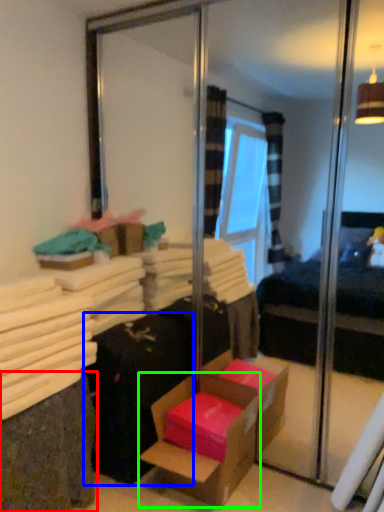
Question: Which object is positioned farthest from shelf (highlighted by a red box)? Select from luggage (highlighted by a blue box) and box (highlighted by a green box).

Choices:
 (A) luggage
 (B) box

Answer: (B)